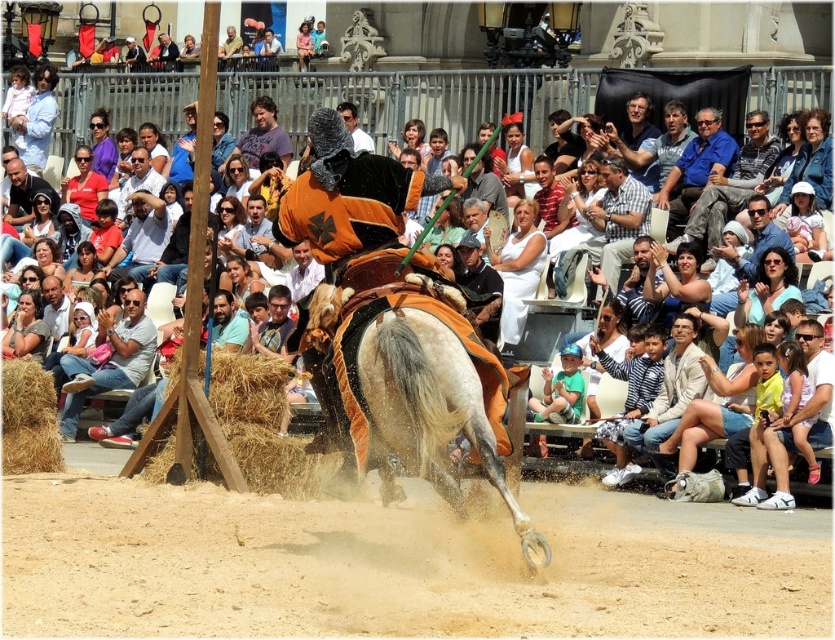
You are a spectator at the event and want to take a photo of the white cotton clothing at center and the brown wooden hay at center. Which object should you focus on first to ensure both are in the frame?

You should focus on the white cotton clothing at center first because the brown wooden hay at center is behind it, so adjusting the focus starting from the front object will help capture both in the frame.

You are a participant in the equestrian event and need to place a small flag exactly at the point marked as point (262, 424). Where should you place the flag in relation to the brown wooden hay at center?

The point (262, 424) is located on the brown wooden hay at center, so you should place the flag directly on top of the brown wooden hay at center.